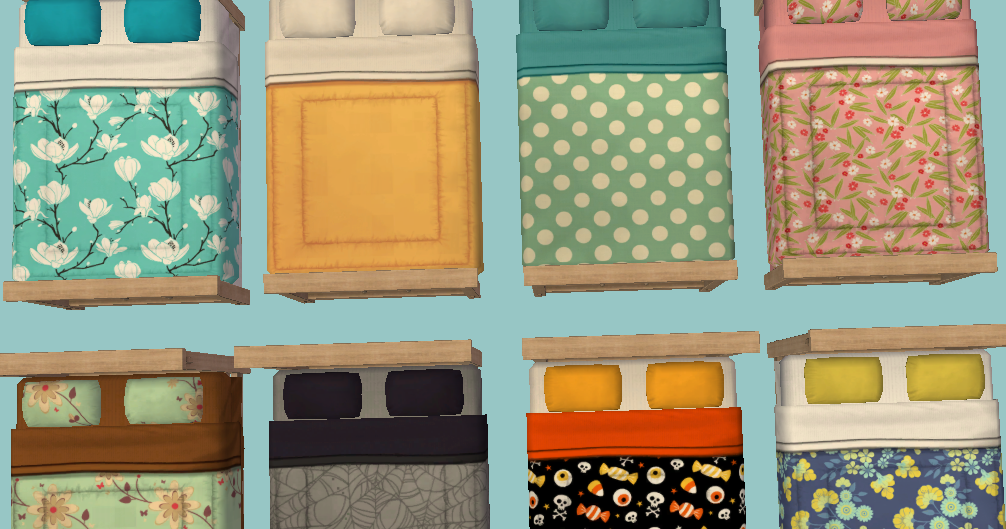
Identify the location of comforters. (906, 504), (611, 485), (350, 506), (88, 506), (90, 169), (395, 160), (630, 175), (870, 144).